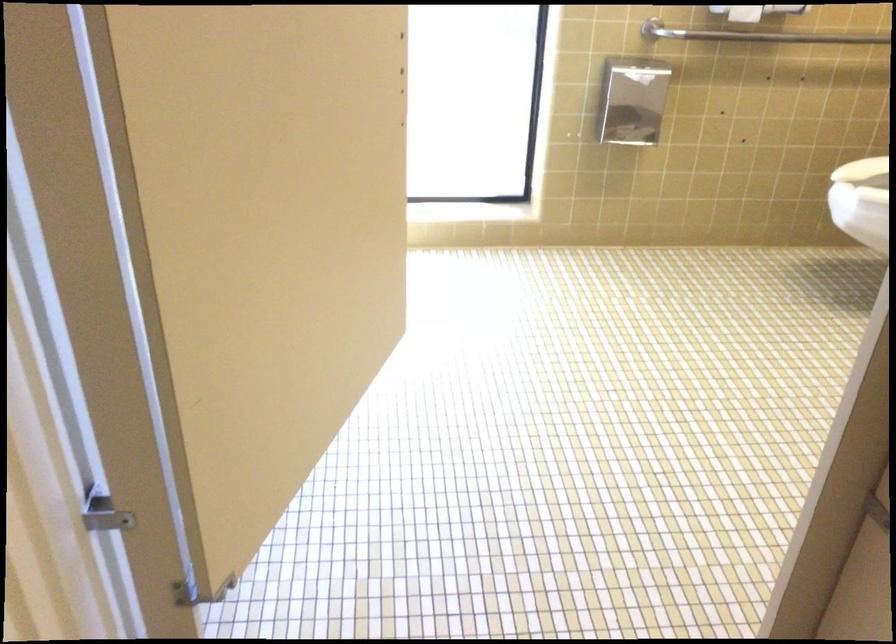
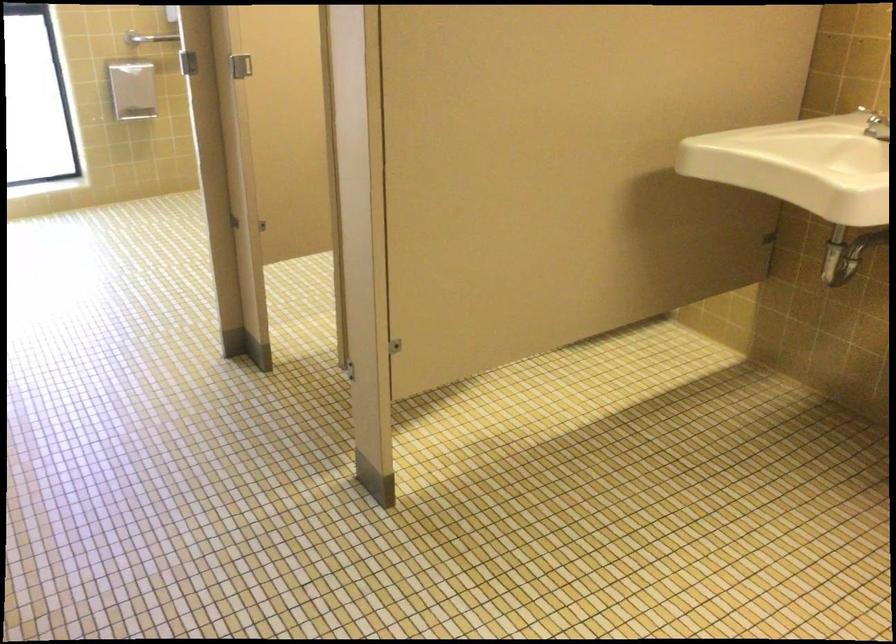
Question: In a continuous first-person perspective shot, in which direction is the camera moving?

Choices:
 (A) Left
 (B) Right
 (C) Forward
 (D) Backward

Answer: (D)